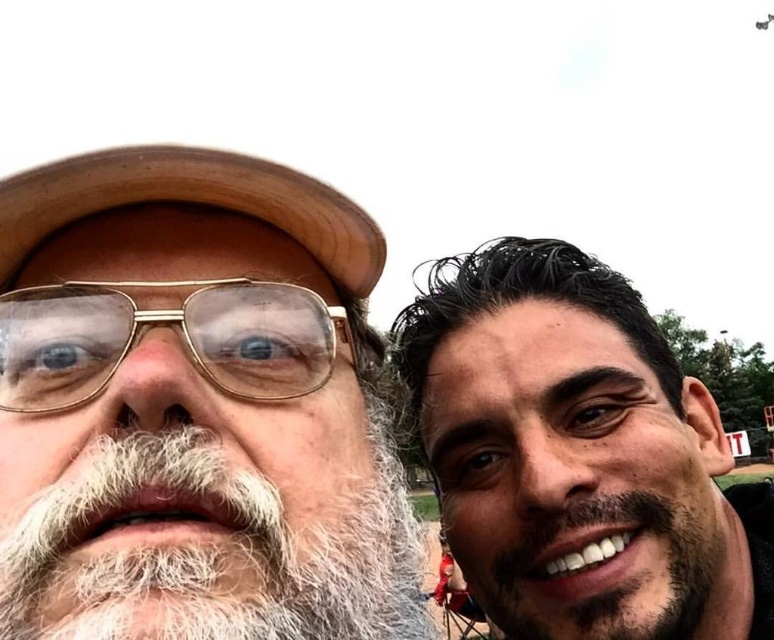
What do you see at coordinates (194, 406) in the screenshot? I see `white beard at left` at bounding box center [194, 406].

Which is more to the left, white beard at left or smooth skin face at upper right?

white beard at left

Between point (225, 346) and point (761, 490), which one is positioned behind?

The point (761, 490) is more distant.

At what (x,y) coordinates should I click in order to perform the action: click on white beard at left. Please return your answer as a coordinate pair (x, y). This screenshot has width=774, height=640. Looking at the image, I should click on [x=194, y=406].

How distant is white fuzzy beard at left from gold-framed glasses at center?

A distance of 25.89 centimeters exists between white fuzzy beard at left and gold-framed glasses at center.

Between white fuzzy beard at left and gold-framed glasses at center, which one appears on the left side from the viewer's perspective?

gold-framed glasses at center

Is point (375, 499) less distant than point (166, 321)?

No.

Locate an element on the screen. The width and height of the screenshot is (774, 640). white fuzzy beard at left is located at coordinates (214, 554).

Is smooth skin face at upper right below brown leather baseball hat at upper left?

Indeed, smooth skin face at upper right is positioned under brown leather baseball hat at upper left.

Image resolution: width=774 pixels, height=640 pixels. What are the coordinates of `smooth skin face at upper right` in the screenshot? It's located at (577, 456).